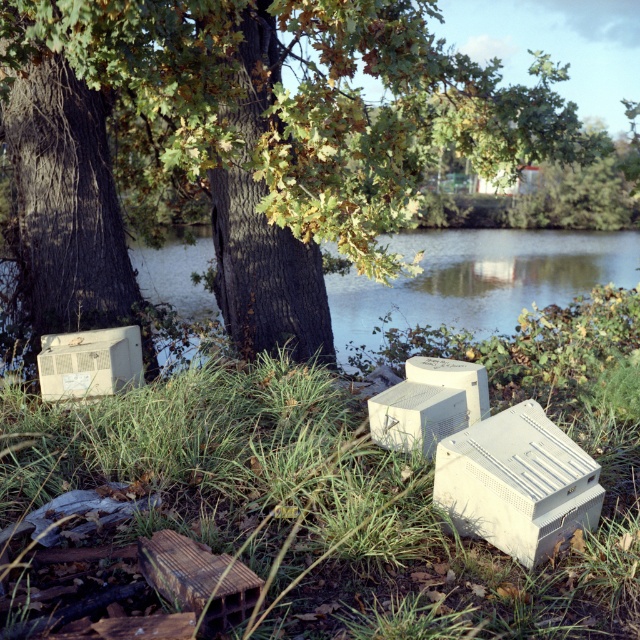
You are standing at the point marked by the coordinates point [248,144] in the scene. Looking around, you see the matte brown tree trunk at center. What is directly beneath your feet?

The point [248,144] corresponds to the matte brown tree trunk at center, so you are standing directly on the matte brown tree trunk at center.